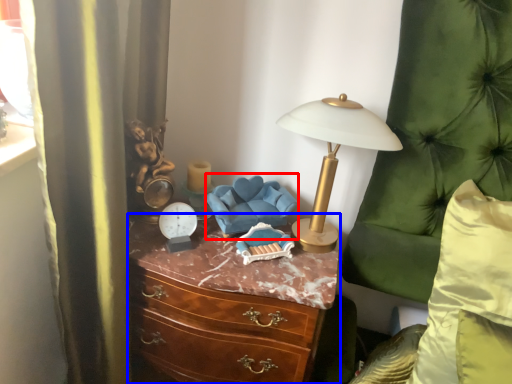
Question: Which point is further to the camera, swivel chair (highlighted by a red box) or chest of drawers (highlighted by a blue box)?

Choices:
 (A) swivel chair
 (B) chest of drawers

Answer: (A)